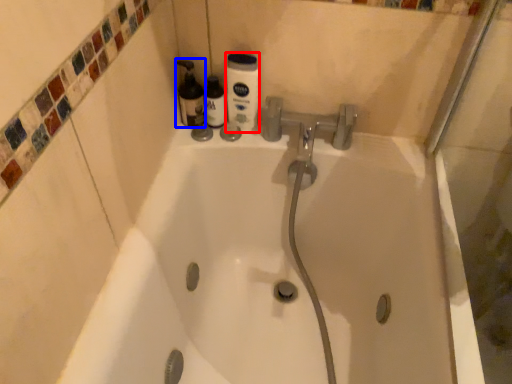
Question: Which of the following is the closest to the observer, cleaning product (highlighted by a red box) or cleaning product (highlighted by a blue box)?

Choices:
 (A) cleaning product
 (B) cleaning product

Answer: (A)